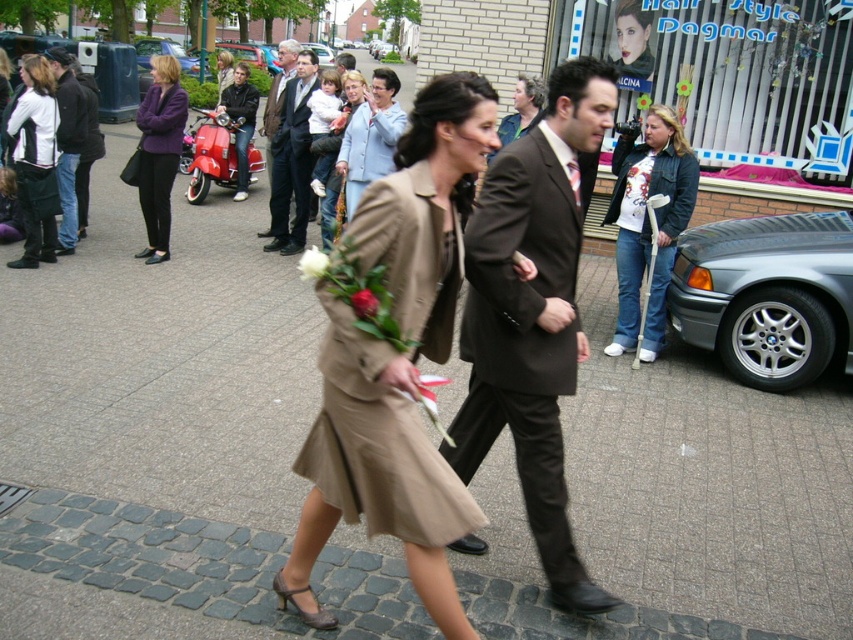
Which is more to the left, white leather jacket at left or dark brown leather jacket at upper left?

From the viewer's perspective, white leather jacket at left appears more on the left side.

Is point (33, 106) farther from camera compared to point (57, 77)?

That is False.

Where is `white leather jacket at left`? This screenshot has height=640, width=853. white leather jacket at left is located at coordinates (35, 161).

How distant is beige fabric dress at center from dark brown leather jacket at upper left?

beige fabric dress at center is 18.83 feet from dark brown leather jacket at upper left.

Is point (421, 448) behind point (64, 250)?

That is False.

Locate an element on the screen. beige fabric dress at center is located at coordinates (376, 444).

Does point (415, 464) come behind point (651, 188)?

No.

Can you confirm if beige fabric dress at center is positioned to the right of white printed t-shirt at center?

Incorrect, beige fabric dress at center is not on the right side of white printed t-shirt at center.

Which is in front, point (343, 506) or point (654, 307)?

Point (343, 506)

The image size is (853, 640). I want to click on beige fabric dress at center, so click(376, 444).